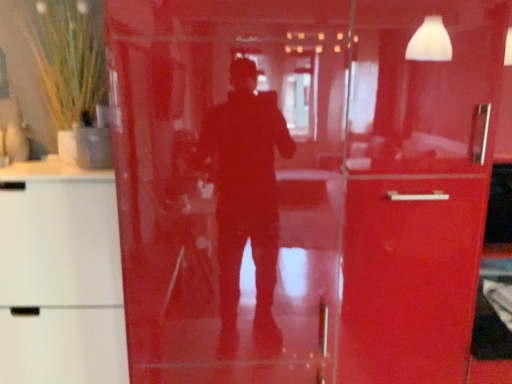
Question: Does white matte cabinet at left have a lesser width compared to green grass-like plant in vase at upper left?

Choices:
 (A) no
 (B) yes

Answer: (A)

Question: Considering the relative sizes of white matte cabinet at left and green grass-like plant in vase at upper left in the image provided, is white matte cabinet at left bigger than green grass-like plant in vase at upper left?

Choices:
 (A) yes
 (B) no

Answer: (A)

Question: Does white matte cabinet at left touch green grass-like plant in vase at upper left?

Choices:
 (A) no
 (B) yes

Answer: (A)

Question: Is green grass-like plant in vase at upper left inside white matte cabinet at left?

Choices:
 (A) no
 (B) yes

Answer: (A)

Question: Does white matte cabinet at left come behind green grass-like plant in vase at upper left?

Choices:
 (A) no
 (B) yes

Answer: (A)

Question: Is white matte cabinet at left not within green grass-like plant in vase at upper left?

Choices:
 (A) yes
 (B) no

Answer: (A)

Question: Is white matte cabinet at left at the back of green grass-like plant in vase at upper left?

Choices:
 (A) yes
 (B) no

Answer: (B)

Question: Considering the relative sizes of green grass-like plant in vase at upper left and white matte cabinet at left in the image provided, is green grass-like plant in vase at upper left smaller than white matte cabinet at left?

Choices:
 (A) yes
 (B) no

Answer: (A)

Question: Is green grass-like plant in vase at upper left to the right of white matte cabinet at left from the viewer's perspective?

Choices:
 (A) no
 (B) yes

Answer: (B)

Question: From a real-world perspective, is green grass-like plant in vase at upper left on white matte cabinet at left?

Choices:
 (A) yes
 (B) no

Answer: (A)

Question: Would you say green grass-like plant in vase at upper left contains white matte cabinet at left?

Choices:
 (A) no
 (B) yes

Answer: (A)

Question: Is green grass-like plant in vase at upper left far away from white matte cabinet at left?

Choices:
 (A) yes
 (B) no

Answer: (B)

Question: Considering the positions of white matte cabinet at left and green grass-like plant in vase at upper left in the image, is white matte cabinet at left bigger or smaller than green grass-like plant in vase at upper left?

Choices:
 (A) big
 (B) small

Answer: (A)